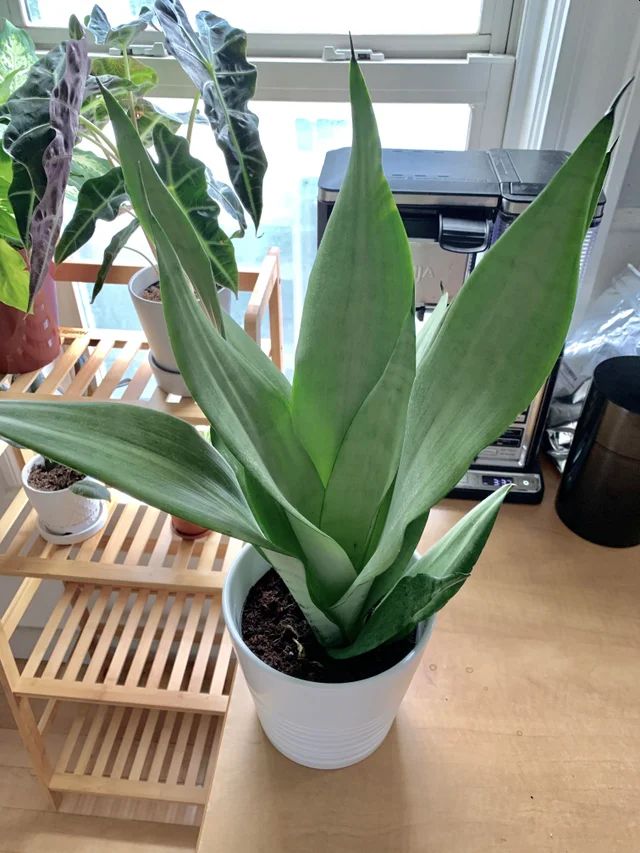
Locate an element on the screen. The width and height of the screenshot is (640, 853). white pot is located at coordinates (278, 699).